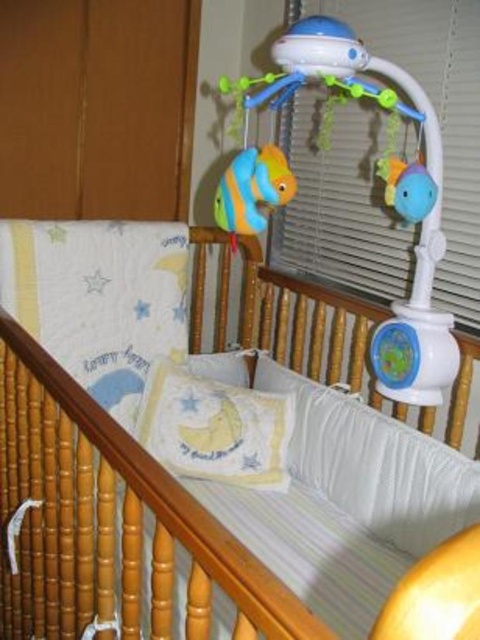
You are a parent checking the safety of the baby crib. You notice the white striped mattress at center and the blue rubber duck at upper right. Which object has a greater width?

The white striped mattress at center has a greater width than the blue rubber duck at upper right.

You are a parent checking the safety of the baby crib. The baby can reach objects within 12 inches. Is the blue rubber duck at upper right within the baby reach from the white striped mattress at center?

The distance between the white striped mattress at center and the blue rubber duck at upper right is 29.46 inches. Since the baby can only reach objects within 12 inches, the blue rubber duck at upper right is out of the baby reach.

You are a parent checking the safety of the baby crib. The white striped mattress at center and the blue plastic mobile at upper center are both in view. Which object is nearer to you?

The white striped mattress at center is closer to the viewer than the blue plastic mobile at upper center.